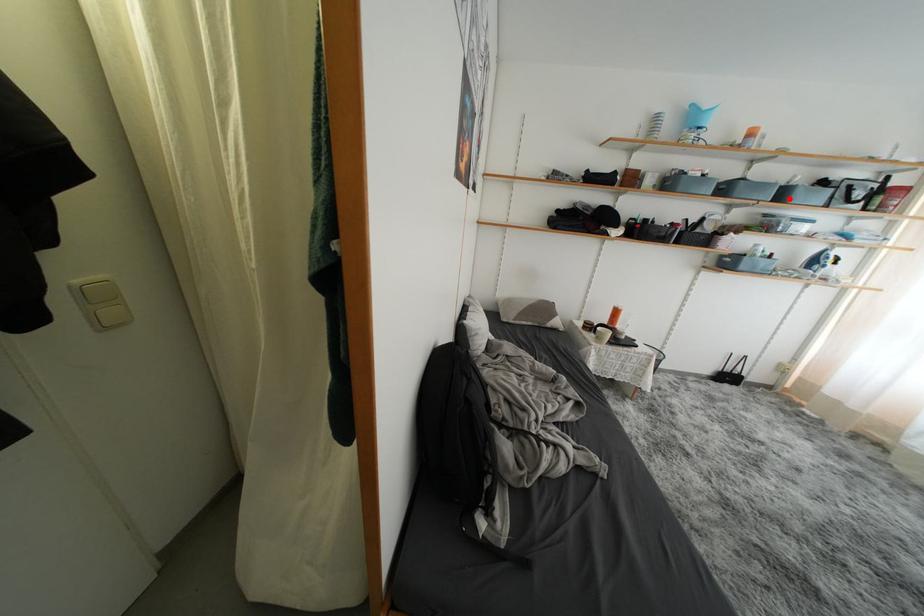
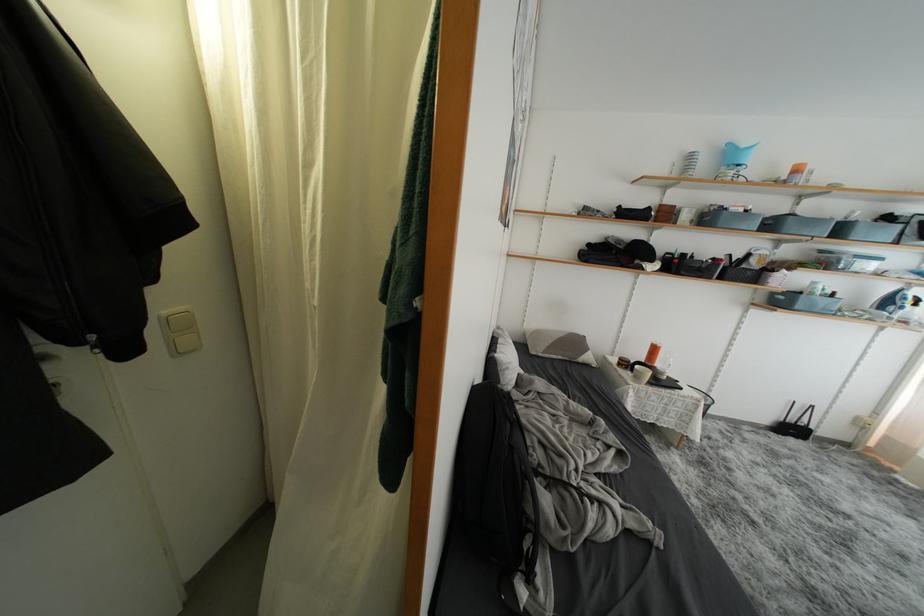
In the second image, find the point that corresponds to the highlighted location in the first image.

(847, 235)